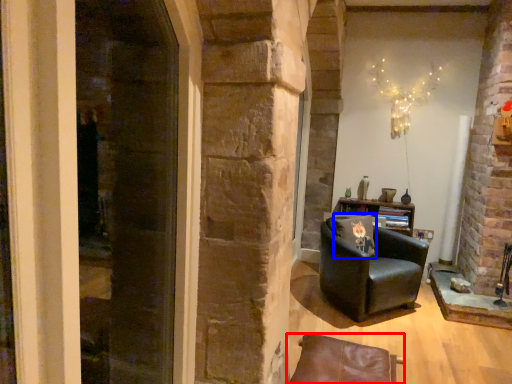
Question: Among these objects, which one is nearest to the camera, chair (highlighted by a red box) or pillow (highlighted by a blue box)?

Choices:
 (A) chair
 (B) pillow

Answer: (A)